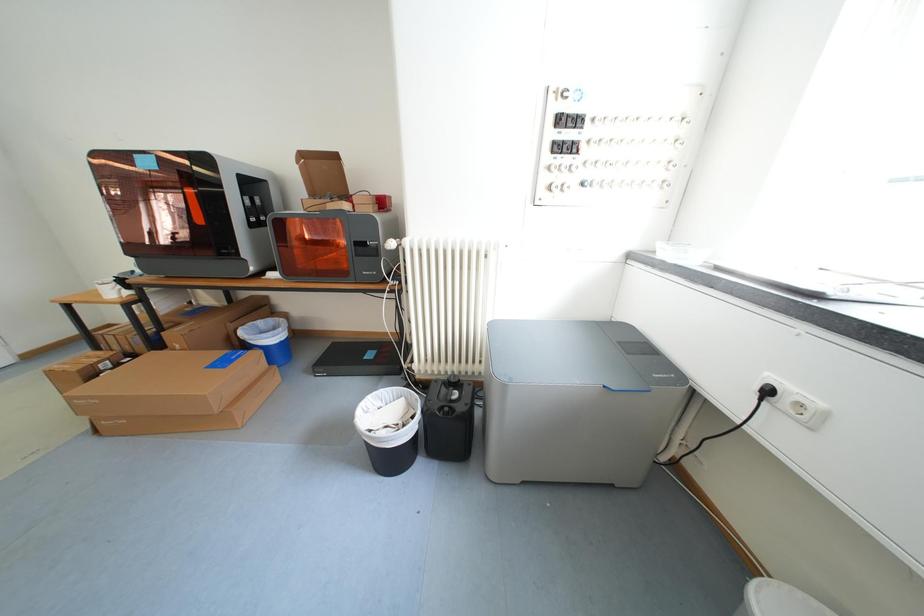
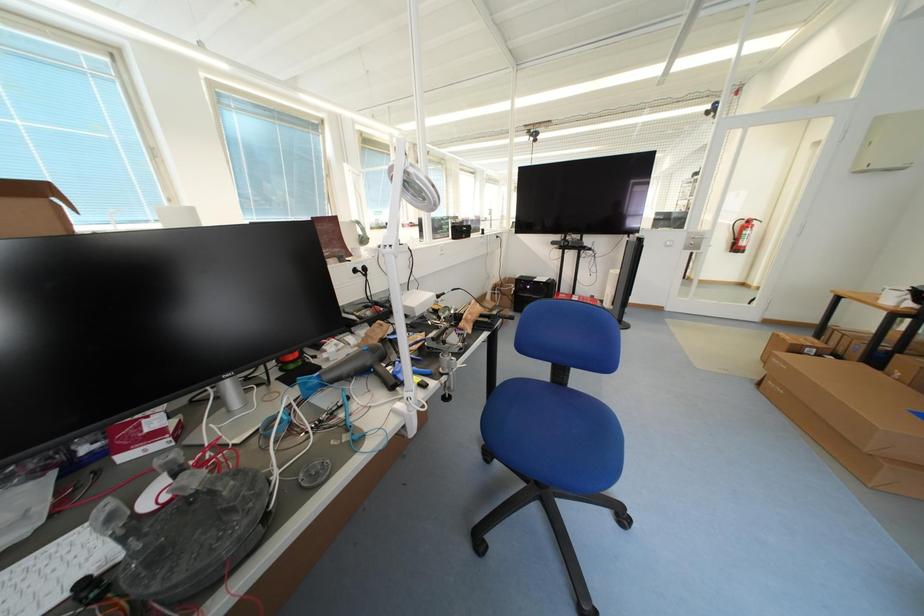
The first image is from the beginning of the video and the second image is from the end. How did the camera likely rotate when shooting the video?

The camera's rotation is toward left-down.